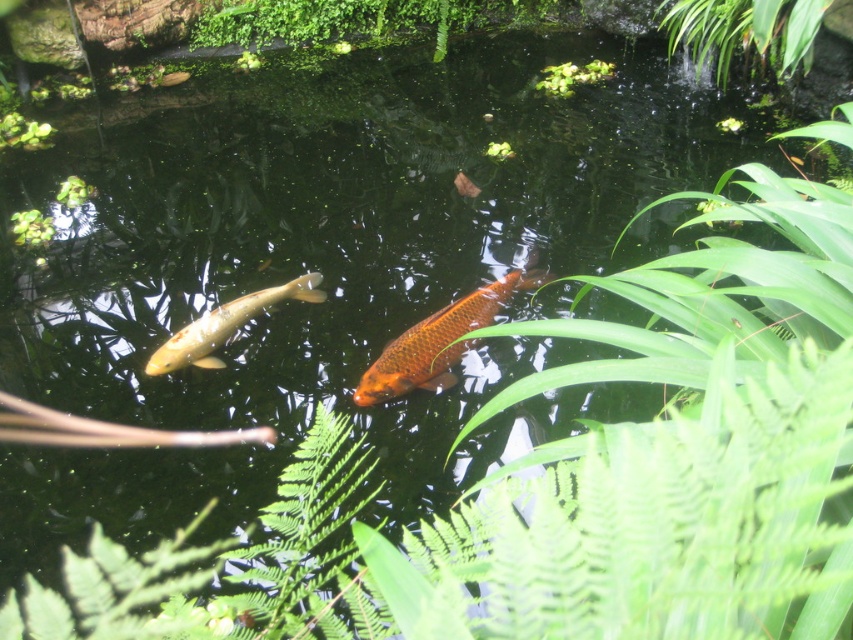
Question: Which object is closer to the camera taking this photo?

Choices:
 (A) golden glossy fish at center
 (B) green mossy rock at upper center

Answer: (A)

Question: Is green mossy rock at upper center further to camera compared to green leafy plant at upper right?

Choices:
 (A) no
 (B) yes

Answer: (B)

Question: Is green mossy rock at upper center above shiny orange fish at center?

Choices:
 (A) no
 (B) yes

Answer: (B)

Question: Which object is the farthest from the green leafy plant at upper right?

Choices:
 (A) shiny orange fish at center
 (B) green mossy rock at upper center

Answer: (B)

Question: Is green mossy rock at upper center bigger than shiny orange fish at center?

Choices:
 (A) no
 (B) yes

Answer: (B)

Question: Which of these objects is positioned closest to the green leafy plant at upper center?

Choices:
 (A) green mossy rock at upper center
 (B) green leafy plant at upper right
 (C) golden glossy fish at center
 (D) shiny orange fish at center

Answer: (B)